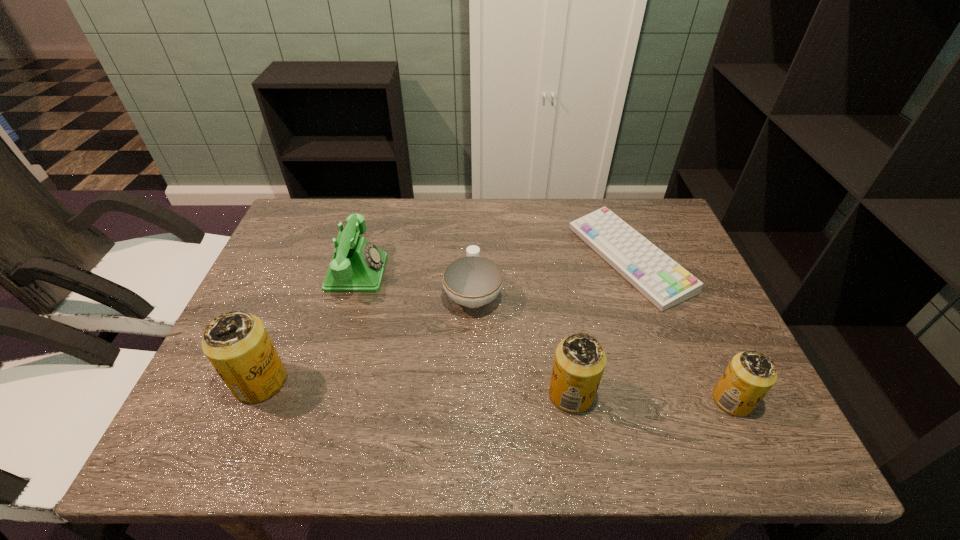
Identify the location of empty location between the rightmost beer can and the telephone. This screenshot has height=540, width=960. (544, 336).

Locate an element on the screen. The height and width of the screenshot is (540, 960). vacant area that lies between the telephone and the leftmost beer can is located at coordinates (309, 327).

This screenshot has height=540, width=960. I want to click on empty location between the shortest beer can and the computer keyboard, so click(681, 330).

The width and height of the screenshot is (960, 540). I want to click on free area in between the shortest object and the second beer can from right to left, so coord(600,327).

Find the location of a particular element. The image size is (960, 540). free space that is in between the rightmost beer can and the second beer can from left to right is located at coordinates (652, 397).

In order to click on vacant area that lies between the fifth object from right to left and the leftmost beer can in this screenshot , I will do `click(309, 327)`.

The width and height of the screenshot is (960, 540). I want to click on free point between the telephone and the leftmost object, so click(309, 327).

I want to click on empty space between the fifth object from right to left and the leftmost beer can, so click(x=309, y=327).

Identify the location of vacant area that lies between the rightmost beer can and the fourth object from left to right. The height and width of the screenshot is (540, 960). (652, 397).

Locate an element on the screen. the fifth closest object to the third object from left to right is located at coordinates (749, 376).